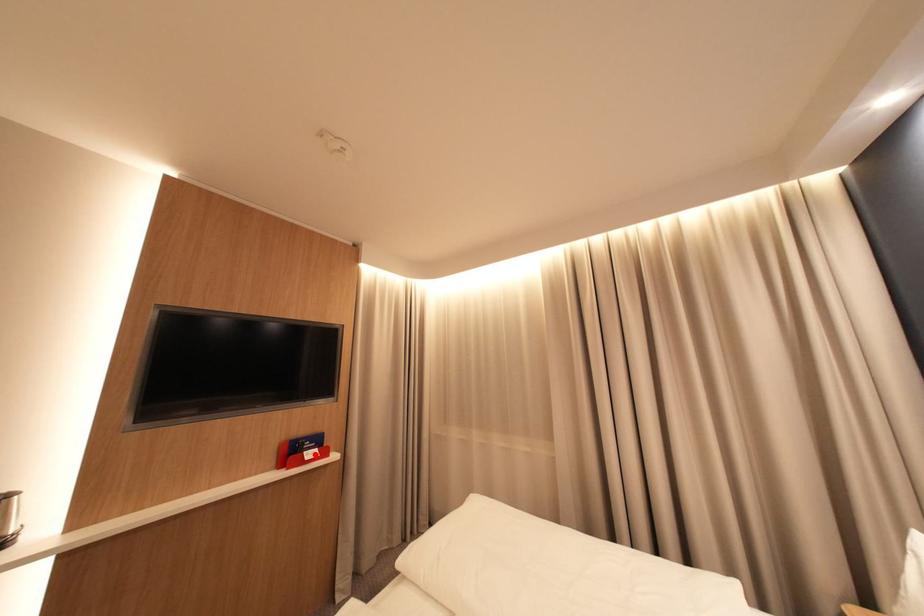
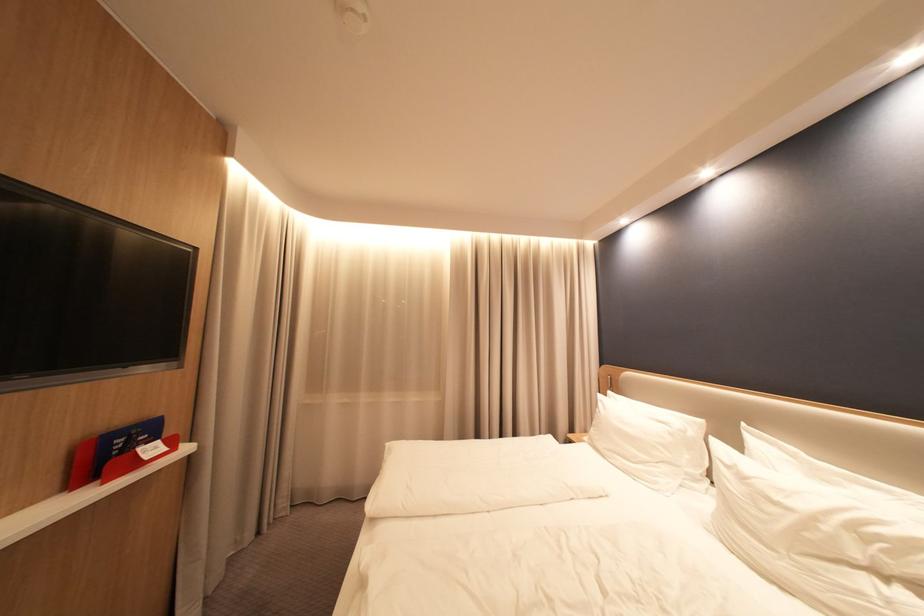
In the second image, find the point that corresponds to the highlighted location in the first image.

(150, 452)